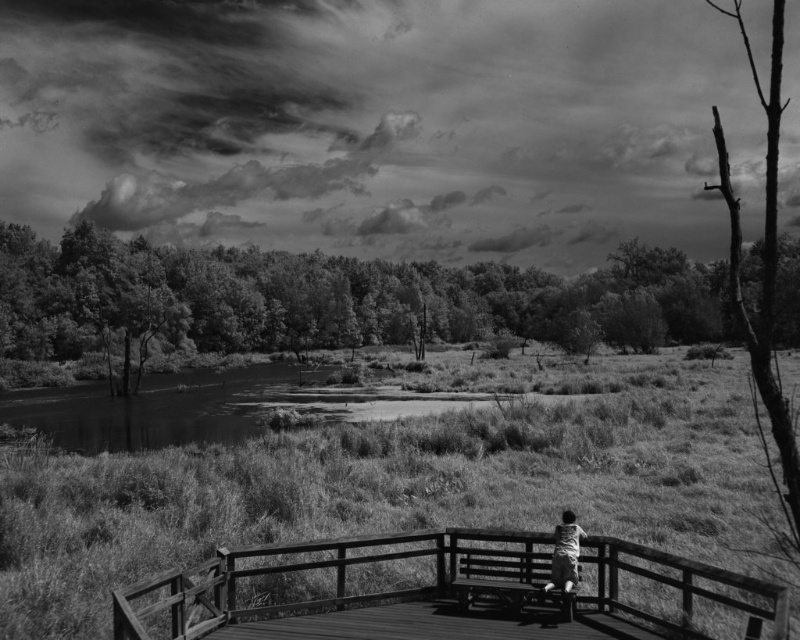
Question: Is wooden bridge at lower center behind light gray fabric shirt at center?

Choices:
 (A) no
 (B) yes

Answer: (A)

Question: Does wooden picnic table at center have a greater width compared to light gray fabric shirt at center?

Choices:
 (A) yes
 (B) no

Answer: (A)

Question: Which point is farther from the camera taking this photo?

Choices:
 (A) (552, 586)
 (B) (462, 596)
 (C) (340, 620)

Answer: (B)

Question: Estimate the real-world distances between objects in this image. Which object is closer to the wooden bridge at lower center?

Choices:
 (A) smooth water at lower left
 (B) light gray fabric shirt at center

Answer: (B)

Question: Is wooden picnic table at center positioned behind light gray fabric shirt at center?

Choices:
 (A) no
 (B) yes

Answer: (A)

Question: Which is farther from the wooden picnic table at center?

Choices:
 (A) smooth water at lower left
 (B) wooden bridge at lower center
 (C) light gray fabric shirt at center

Answer: (A)